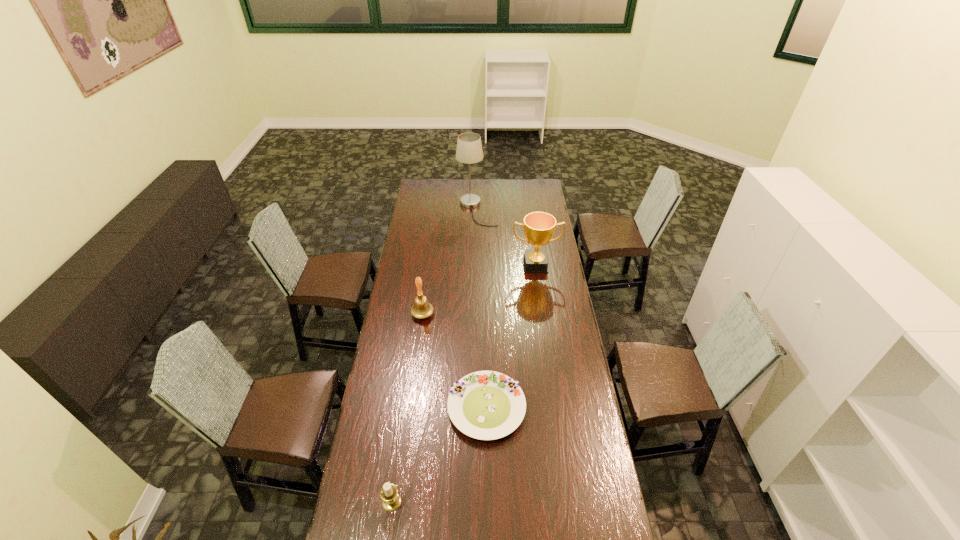
In order to click on vacant area at the left edge in this screenshot , I will do `click(399, 441)`.

Locate an element on the screen. This screenshot has width=960, height=540. vacant position at the right edge of the desktop is located at coordinates (551, 285).

You are a GUI agent. You are given a task and a screenshot of the screen. Output one action in this format:
    pyautogui.click(x=<x>, y=<y>)
    Task: Click on the vacant area at the far left corner
    The height and width of the screenshot is (540, 960).
    Given the screenshot: What is the action you would take?
    pyautogui.click(x=435, y=196)

Image resolution: width=960 pixels, height=540 pixels. What are the coordinates of `empty location between the award and the fourth farthest object` in the screenshot? It's located at (511, 336).

At what (x,y) coordinates should I click in order to perform the action: click on free space between the salad plate and the award. Please return your answer as a coordinate pair (x, y). This screenshot has width=960, height=540. Looking at the image, I should click on (511, 336).

I want to click on vacant space that is in between the salad plate and the second shortest object, so click(x=440, y=455).

Find the location of `vacant region between the candle holder and the third shortest object`. vacant region between the candle holder and the third shortest object is located at coordinates (407, 408).

I want to click on free point between the second shortest object and the bell, so click(x=407, y=408).

Where is `object that stands as the closest to the bell`? object that stands as the closest to the bell is located at coordinates (486, 405).

Where is `object that is the second closest to the third tallest object`? object that is the second closest to the third tallest object is located at coordinates (539, 227).